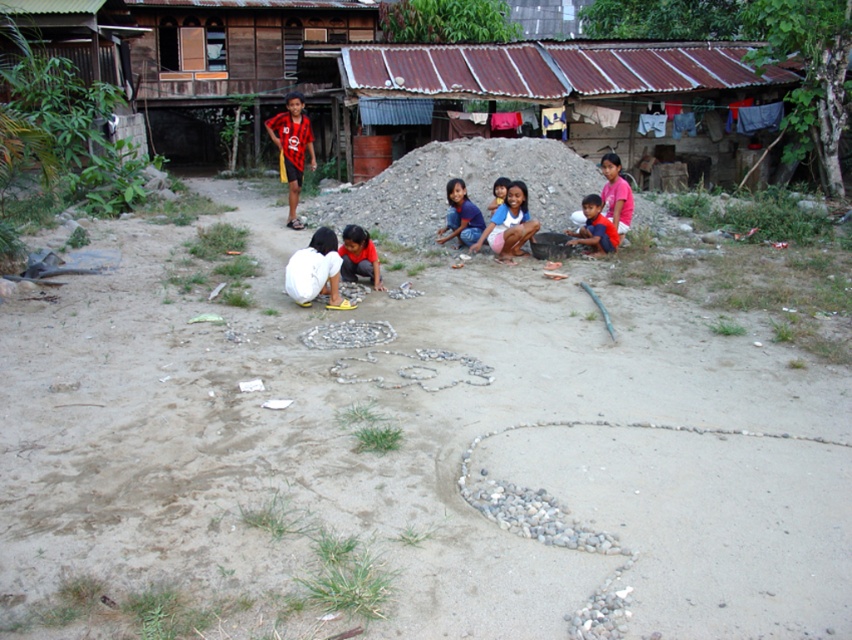
Question: Is white fabric at center to the right of white matte shirt at center from the viewer's perspective?

Choices:
 (A) yes
 (B) no

Answer: (B)

Question: Which of these objects is positioned farthest from the brown sandy dirt field at center?

Choices:
 (A) orange t-shirt at center
 (B) matte blue shirt at center
 (C) red striped shirt at center

Answer: (C)

Question: Which object is closer to the camera taking this photo?

Choices:
 (A) orange t-shirt at center
 (B) white matte shirt at center
 (C) rusty metal hut at upper center
 (D) red striped shirt at center

Answer: (B)

Question: Which point appears farthest from the camera in this image?

Choices:
 (A) (511, 445)
 (B) (504, 184)

Answer: (B)

Question: Is rusty metal hut at upper center bigger than matte blue shirt at center?

Choices:
 (A) no
 (B) yes

Answer: (B)

Question: Is pink cotton shorts at center thinner than smooth skin face at center?

Choices:
 (A) yes
 (B) no

Answer: (B)